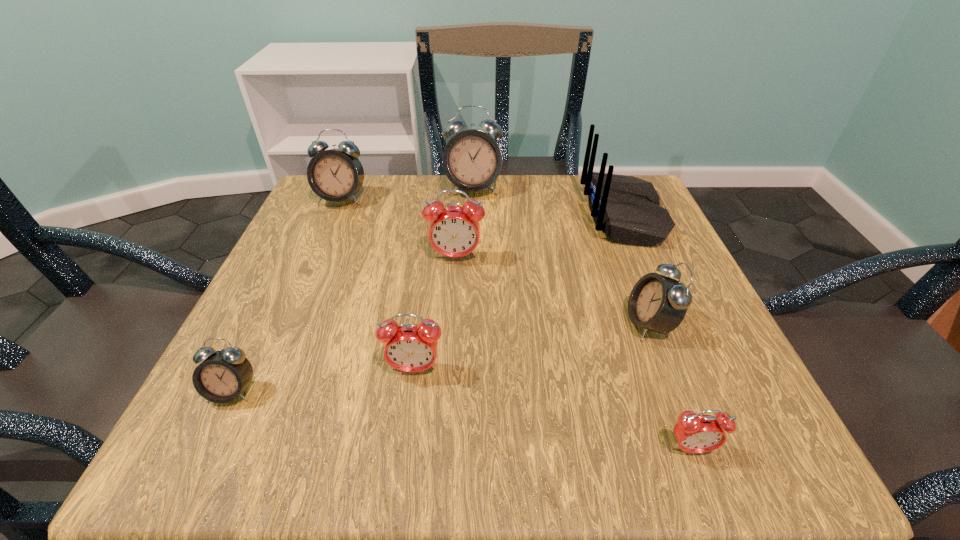
I want to click on the smallest red alarm clock, so click(695, 433).

This screenshot has width=960, height=540. In order to click on the nearest alarm clock in this screenshot , I will do pos(695,433).

Image resolution: width=960 pixels, height=540 pixels. I want to click on free location located 0.330m on the face of the tallest alarm clock, so click(x=470, y=303).

The width and height of the screenshot is (960, 540). In order to click on free space located on the back of the black router in this screenshot , I will do `click(417, 215)`.

The height and width of the screenshot is (540, 960). I want to click on vacant space located on the back of the black router, so click(x=526, y=215).

I want to click on vacant area situated on the back of the black router, so click(x=535, y=215).

Find the location of `blank space located 0.160m on the face of the third smallest white alarm clock`. blank space located 0.160m on the face of the third smallest white alarm clock is located at coordinates (317, 255).

At what (x,y) coordinates should I click in order to perform the action: click on vacant position located 0.350m on the face of the fourth farthest object. Please return your answer as a coordinate pair (x, y). This screenshot has width=960, height=540. Looking at the image, I should click on (444, 437).

You are a GUI agent. You are given a task and a screenshot of the screen. Output one action in this format:
    pyautogui.click(x=<x>, y=<y>)
    Task: Click on the vacant space located 0.370m on the face of the second nearest white alarm clock
    Image resolution: width=960 pixels, height=540 pixels.
    Given the screenshot: What is the action you would take?
    pyautogui.click(x=402, y=324)

Locate an element on the screen. The height and width of the screenshot is (540, 960). vacant space located 0.300m on the face of the second nearest white alarm clock is located at coordinates (444, 324).